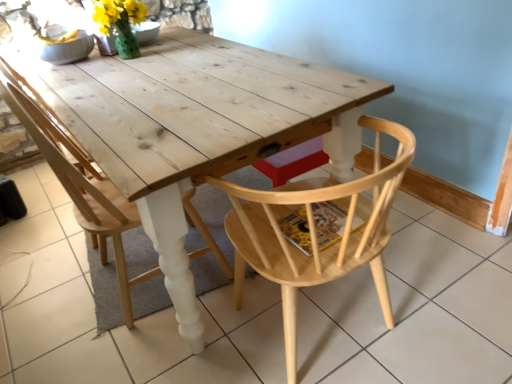
Question: Is natural wood table at center outside natural wood chair at center, the 2th chair positioned from the left?

Choices:
 (A) no
 (B) yes

Answer: (B)

Question: Can you confirm if natural wood table at center is thinner than natural wood chair at center, the 1th chair from the right?

Choices:
 (A) yes
 (B) no

Answer: (B)

Question: From a real-world perspective, is natural wood table at center positioned under natural wood chair at center, the 1th chair from the right, based on gravity?

Choices:
 (A) yes
 (B) no

Answer: (A)

Question: Does natural wood table at center have a greater height compared to natural wood chair at center, the 2th chair positioned from the left?

Choices:
 (A) no
 (B) yes

Answer: (A)

Question: From a real-world perspective, is natural wood table at center over natural wood chair at center, the 1th chair from the right?

Choices:
 (A) no
 (B) yes

Answer: (A)

Question: Considering the positions of natural wood chair at center, the 1th chair from the right, and natural wood table at center in the image, is natural wood chair at center, the 1th chair from the right, wider or thinner than natural wood table at center?

Choices:
 (A) wide
 (B) thin

Answer: (B)

Question: In terms of size, does natural wood chair at center, the 2th chair positioned from the left, appear bigger or smaller than natural wood table at center?

Choices:
 (A) big
 (B) small

Answer: (B)

Question: Considering the positions of natural wood chair at center, the 1th chair from the right, and natural wood table at center in the image, is natural wood chair at center, the 1th chair from the right, taller or shorter than natural wood table at center?

Choices:
 (A) tall
 (B) short

Answer: (A)

Question: Relative to natural wood table at center, is natural wood chair at center, the 2th chair positioned from the left, in front or behind?

Choices:
 (A) behind
 (B) front

Answer: (A)

Question: Is natural wood chair at center, which is counted as the 2th chair, starting from the right, to the left or to the right of natural wood table at center in the image?

Choices:
 (A) right
 (B) left

Answer: (B)

Question: Considering their positions, is natural wood chair at center, arranged as the 1th chair when viewed from the left, located in front of or behind natural wood table at center?

Choices:
 (A) behind
 (B) front

Answer: (A)

Question: From the image's perspective, is natural wood chair at center, which is counted as the 2th chair, starting from the right, above or below natural wood table at center?

Choices:
 (A) below
 (B) above

Answer: (B)

Question: In terms of height, does natural wood chair at center, arranged as the 1th chair when viewed from the left, look taller or shorter compared to natural wood table at center?

Choices:
 (A) short
 (B) tall

Answer: (B)

Question: Is natural wood chair at center, the 1th chair from the right, taller or shorter than natural wood chair at center, arranged as the 1th chair when viewed from the left?

Choices:
 (A) tall
 (B) short

Answer: (B)

Question: Relative to natural wood chair at center, arranged as the 1th chair when viewed from the left, is natural wood chair at center, the 2th chair positioned from the left, in front or behind?

Choices:
 (A) front
 (B) behind

Answer: (A)